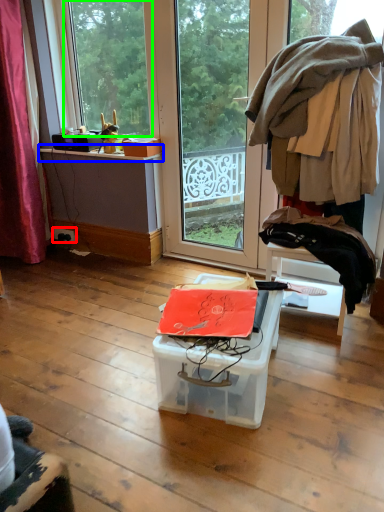
Question: Based on their relative distances, which object is nearer to power outlet (highlighted by a red box)? Choose from window sill (highlighted by a blue box) and window (highlighted by a green box).

Choices:
 (A) window sill
 (B) window

Answer: (A)